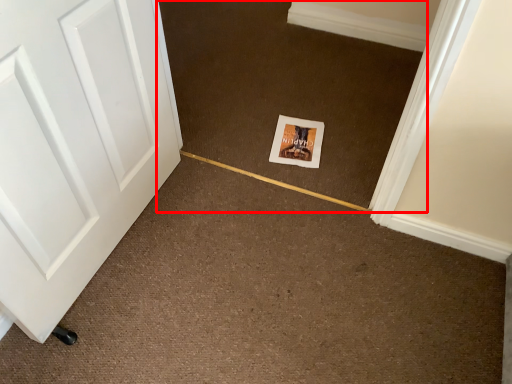
Question: From the image, what is the correct spatial relationship of plain (annotated by the red box) in relation to postcard?

Choices:
 (A) right
 (B) left

Answer: (B)